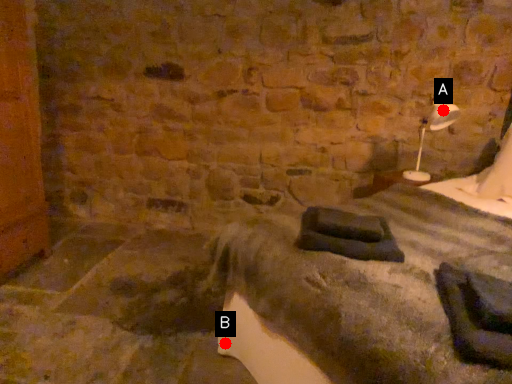
Question: Two points are circled on the image, labeled by A and B beside each circle. Which of the following is the farthest from the observer?

Choices:
 (A) A is further
 (B) B is further

Answer: (A)